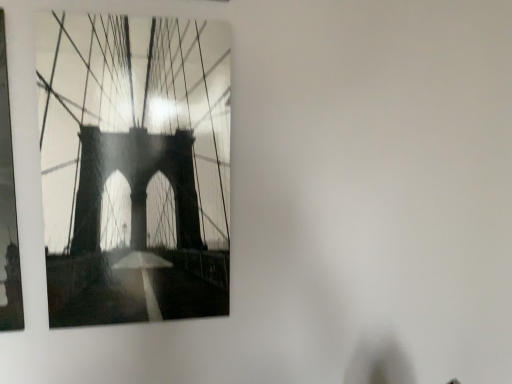
I want to click on black matte bridge at left, so click(x=134, y=167).

The height and width of the screenshot is (384, 512). What do you see at coordinates (134, 167) in the screenshot?
I see `black matte bridge at left` at bounding box center [134, 167].

At what (x,y) coordinates should I click in order to perform the action: click on black matte bridge at left. Please return your answer as a coordinate pair (x, y). This screenshot has width=512, height=384. Looking at the image, I should click on (134, 167).